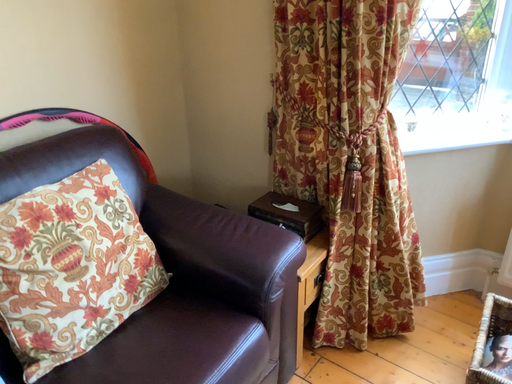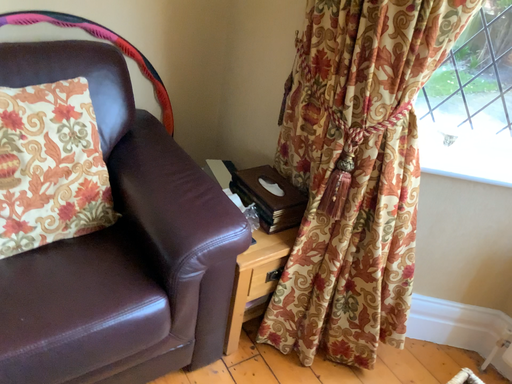
Question: How did the camera likely rotate when shooting the video?

Choices:
 (A) rotated right
 (B) rotated left

Answer: (B)